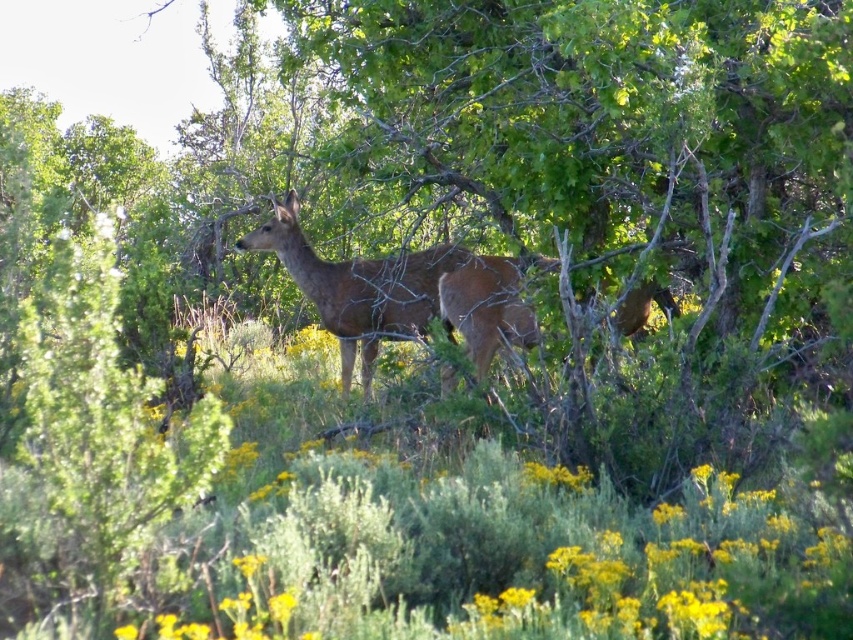
Question: Where is green leafy tree at center located in relation to brown matte/deer at center in the image?

Choices:
 (A) above
 (B) below

Answer: (A)

Question: Can you confirm if green leafy tree at center is smaller than brown matte/deer at center?

Choices:
 (A) yes
 (B) no

Answer: (B)

Question: Among these objects, which one is farthest from the camera?

Choices:
 (A) brown matte/deer at center
 (B) green leafy tree at center

Answer: (A)

Question: Which of the following is the closest to the observer?

Choices:
 (A) brown matte/deer at center
 (B) green leafy tree at center

Answer: (B)

Question: Where is green leafy tree at center located in relation to brown matte/deer at center in the image?

Choices:
 (A) above
 (B) below

Answer: (A)

Question: Which point is farther from the camera taking this photo?

Choices:
 (A) (534, 232)
 (B) (267, 227)

Answer: (A)